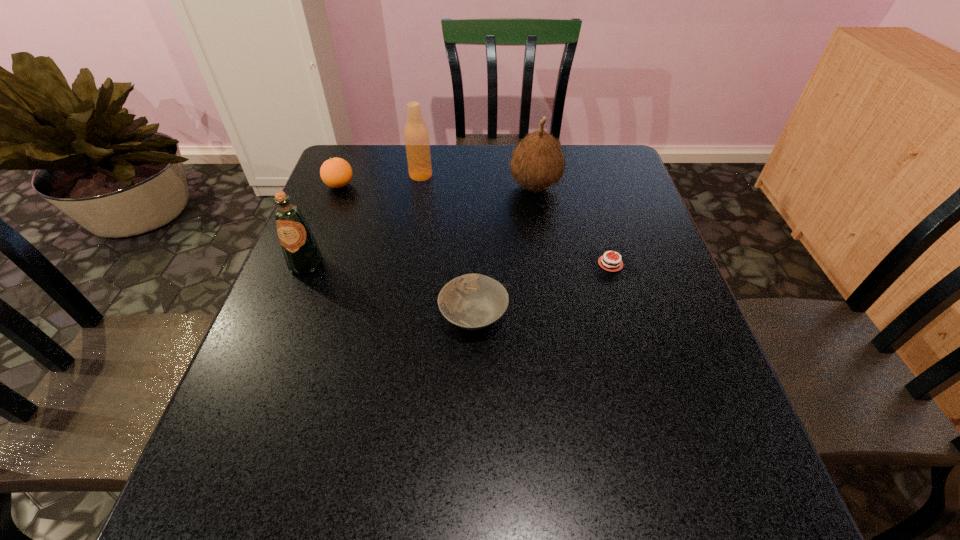
Identify the location of the third closest object to the second shortest object. The height and width of the screenshot is (540, 960). (538, 162).

What are the coordinates of `vacant area that satisfies the following two spatial constraints: 1. on the surface of the rightmost object; 2. on the right side of the coconut` in the screenshot? It's located at click(x=547, y=264).

Find the location of a particular element. free spot that satisfies the following two spatial constraints: 1. on the surface of the second object from right to left; 2. on the front-facing side of the olive oil is located at coordinates (547, 264).

Find the location of `blank area in the image that satisfies the following two spatial constraints: 1. on the front-facing side of the olive oil; 2. on the right side of the second shortest object`. blank area in the image that satisfies the following two spatial constraints: 1. on the front-facing side of the olive oil; 2. on the right side of the second shortest object is located at coordinates (287, 315).

Where is `free point that satisfies the following two spatial constraints: 1. on the back side of the orange; 2. on the right side of the beer bottle`? The image size is (960, 540). free point that satisfies the following two spatial constraints: 1. on the back side of the orange; 2. on the right side of the beer bottle is located at coordinates (344, 176).

Locate an element on the screen. free space that satisfies the following two spatial constraints: 1. on the surface of the chocolate cake; 2. on the left side of the fifth object from left to right is located at coordinates (547, 264).